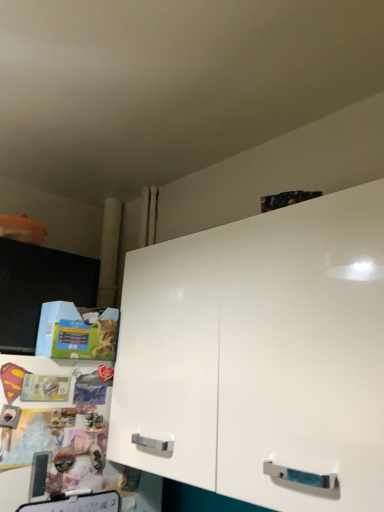
Question: Considering the positions of point (74, 282) and point (127, 360), is point (74, 282) closer or farther from the camera than point (127, 360)?

Choices:
 (A) farther
 (B) closer

Answer: (A)

Question: Considering the positions of black glossy cabinet at left, placed as the 2th cabinetry when sorted from right to left, and white glossy cabinet at upper right, positioned as the 1th cabinetry in right-to-left order, in the image, is black glossy cabinet at left, placed as the 2th cabinetry when sorted from right to left, bigger or smaller than white glossy cabinet at upper right, positioned as the 1th cabinetry in right-to-left order,?

Choices:
 (A) small
 (B) big

Answer: (A)

Question: From the image's perspective, is black glossy cabinet at left, placed as the 2th cabinetry when sorted from right to left, located above or below white glossy cabinet at upper right, positioned as the 1th cabinetry in right-to-left order?

Choices:
 (A) below
 (B) above

Answer: (B)

Question: Considering the positions of white glossy cabinet at upper right, positioned as the 1th cabinetry in right-to-left order, and black glossy cabinet at left, placed as the 2th cabinetry when sorted from right to left, in the image, is white glossy cabinet at upper right, positioned as the 1th cabinetry in right-to-left order, wider or thinner than black glossy cabinet at left, placed as the 2th cabinetry when sorted from right to left,?

Choices:
 (A) thin
 (B) wide

Answer: (B)

Question: Is white glossy cabinet at upper right, positioned as the 1th cabinetry in right-to-left order, taller or shorter than black glossy cabinet at left, which is counted as the first cabinetry, starting from the left?

Choices:
 (A) short
 (B) tall

Answer: (B)

Question: Is point (223, 274) closer or farther from the camera than point (31, 324)?

Choices:
 (A) closer
 (B) farther

Answer: (A)

Question: From a real-world perspective, is white glossy cabinet at upper right, which ranks as the second cabinetry in left-to-right order, above or below black glossy cabinet at left, which is counted as the first cabinetry, starting from the left?

Choices:
 (A) above
 (B) below

Answer: (B)